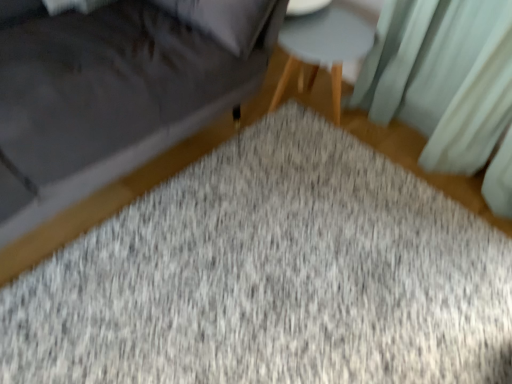
Question: Would you say light teal fabric curtain at upper right is to the left or to the right of gray textured mat at center in the picture?

Choices:
 (A) right
 (B) left

Answer: (A)

Question: From a real-world perspective, is light teal fabric curtain at upper right positioned above or below gray textured mat at center?

Choices:
 (A) below
 (B) above

Answer: (B)

Question: Which is farther from the light gray wood stool at center?

Choices:
 (A) velvet gray sofa at lower left
 (B) light teal fabric curtain at upper right
 (C) gray textured mat at center

Answer: (C)

Question: Estimate the real-world distances between objects in this image. Which object is closer to the velvet gray sofa at lower left?

Choices:
 (A) light gray wood stool at center
 (B) light teal fabric curtain at upper right
 (C) gray textured mat at center

Answer: (A)